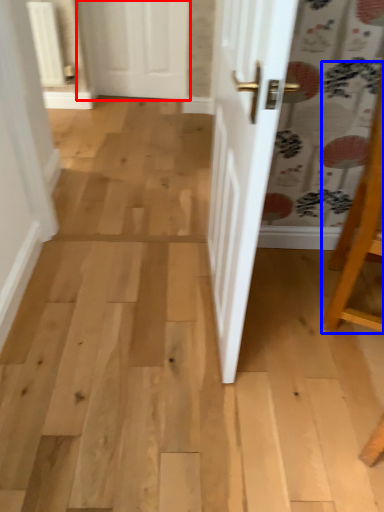
Question: Which object appears farthest to the camera in this image, door (highlighted by a red box) or furniture (highlighted by a blue box)?

Choices:
 (A) door
 (B) furniture

Answer: (A)